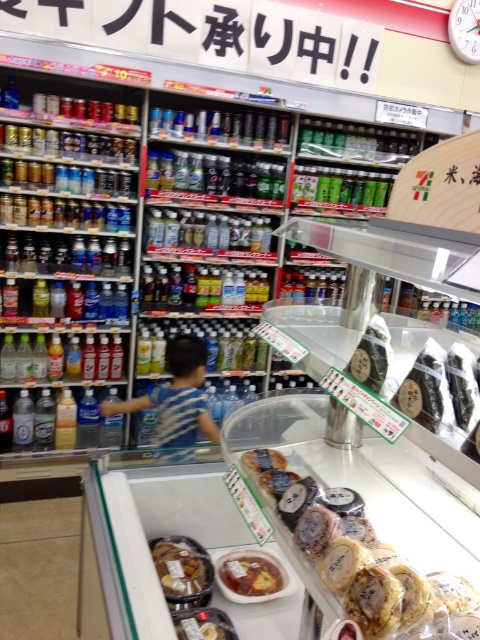
Who is taller, translucent plastic containers at center or shiny plastic container at center?

translucent plastic containers at center is taller.

Can you confirm if translucent plastic containers at center is positioned to the left of shiny plastic container at center?

No, translucent plastic containers at center is not to the left of shiny plastic container at center.

Between point (412, 630) and point (276, 465), which one is positioned behind?

The point (276, 465) is behind.

The width and height of the screenshot is (480, 640). Find the location of `translucent plastic containers at center`. translucent plastic containers at center is located at coordinates (369, 564).

Where is `smooth yellow cake at center`? smooth yellow cake at center is located at coordinates (201, 628).

Which is behind, point (190, 620) or point (252, 465)?

Positioned behind is point (252, 465).

This screenshot has height=640, width=480. I want to click on smooth yellow cake at center, so click(x=201, y=628).

Is point (375, 612) positioned behind point (192, 589)?

No, it is in front of (192, 589).

Between translucent plastic containers at center and golden brown cookie at center, which one appears on the right side from the viewer's perspective?

translucent plastic containers at center

Is point (342, 547) less distant than point (203, 579)?

Yes, it is.

Identify the location of translucent plastic containers at center. The width and height of the screenshot is (480, 640). (369, 564).